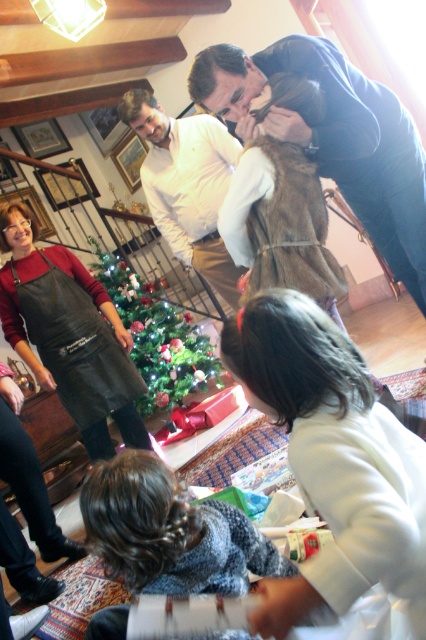
You are a guest at the holiday gathering and want to take a photo of the green shiny christmas tree at center without blocking the white matte jacket at lower right. Since the jacket is smaller, where should you stand to ensure the tree is fully visible while keeping the jacket in the frame?

Since the white matte jacket at lower right is smaller than the green shiny christmas tree at center, you should position yourself to the left side of the scene. This way, the larger tree will dominate the center of the photo, and the smaller jacket can be included at the edge without blocking the tree.

You are a guest at the holiday gathering and want to know which item is larger between the black leather apron at left and the green shiny christmas tree at center. Can you tell me?

The green shiny christmas tree at center is larger than the black leather apron at left.

You are standing at the origin point in the center of the image. Where is the white matte jacket at lower right located relative to you?

The white matte jacket at lower right is located at coordinates approximately 0.717 on the x axis and 0.782 on the y axis relative to the center of the image.